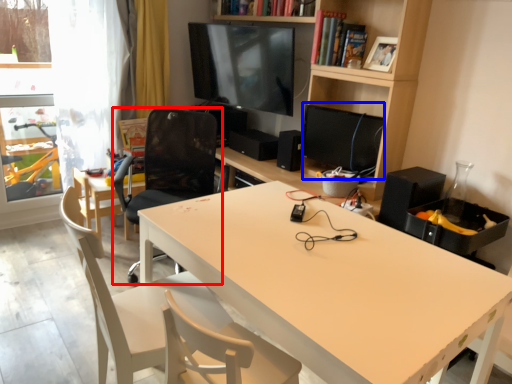
Question: Among these objects, which one is nearest to the camera, chair (highlighted by a red box) or computer monitor (highlighted by a blue box)?

Choices:
 (A) chair
 (B) computer monitor

Answer: (A)